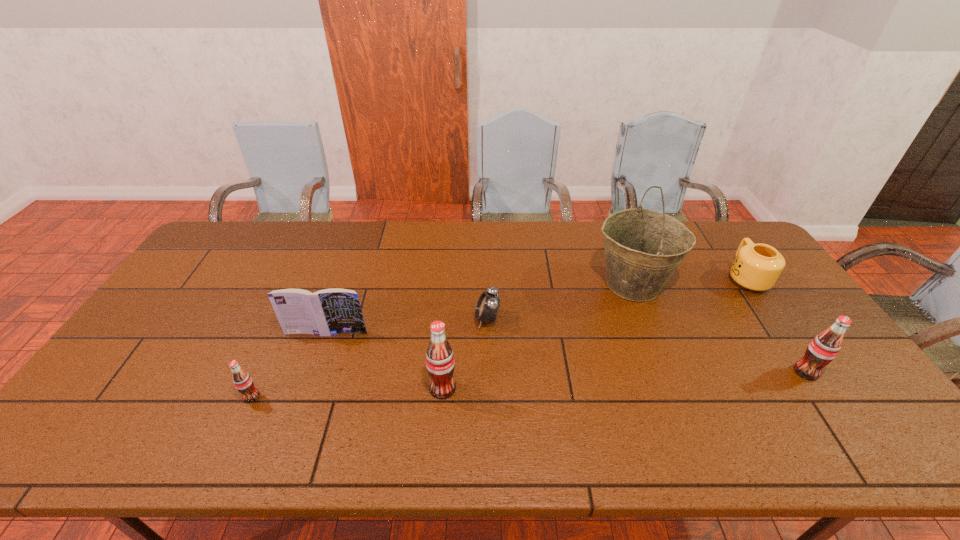
Locate an element on the screen. This screenshot has width=960, height=540. wine bucket that is at the far edge is located at coordinates (643, 247).

At what (x,y) coordinates should I click in order to perform the action: click on mug that is positioned at the far edge. Please return your answer as a coordinate pair (x, y). Looking at the image, I should click on coord(757,267).

This screenshot has width=960, height=540. What are the coordinates of `soda that is at the right edge` in the screenshot? It's located at (825, 346).

In order to click on mug that is positioned at the right edge in this screenshot , I will do `click(757, 267)`.

What are the coordinates of `object that is at the far right corner` in the screenshot? It's located at (757, 267).

Find the location of a particular element. free region at the far edge of the desktop is located at coordinates (535, 221).

You are a GUI agent. You are given a task and a screenshot of the screen. Output one action in this format:
    pyautogui.click(x=<x>, y=<y>)
    Task: Click on the free space at the near edge of the desktop
    This screenshot has height=540, width=960.
    Given the screenshot: What is the action you would take?
    pyautogui.click(x=235, y=410)

Locate an element on the screen. The image size is (960, 540). vacant space at the left edge of the desktop is located at coordinates (204, 296).

The image size is (960, 540). I want to click on vacant space at the right edge of the desktop, so click(x=830, y=384).

In order to click on free area in between the fourth object from right to left and the book in this screenshot , I will do `click(407, 326)`.